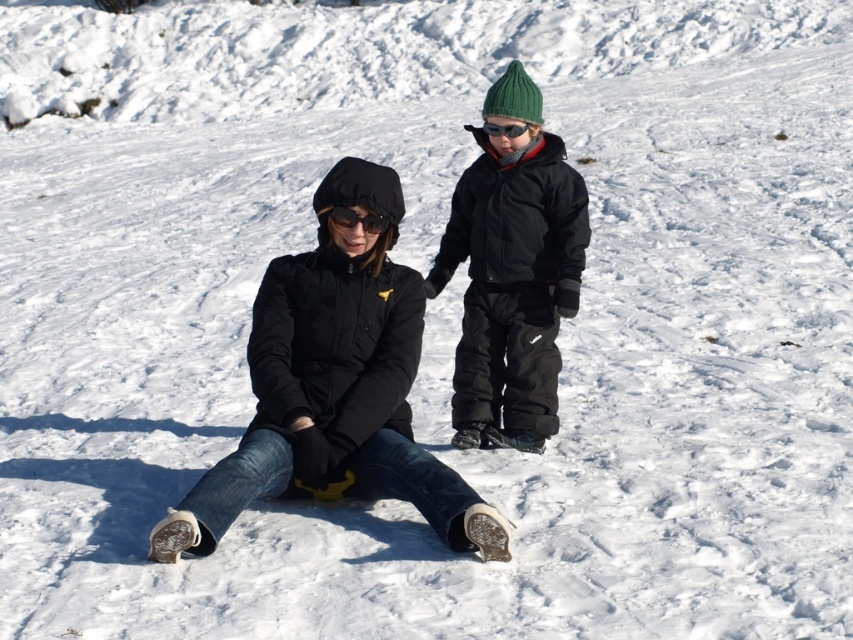
Who is more forward, (524, 372) or (367, 211)?

Point (367, 211) is more forward.

The height and width of the screenshot is (640, 853). Describe the element at coordinates (404, 340) in the screenshot. I see `black matte jacket at center` at that location.

Find the location of `black matte jacket at center`. black matte jacket at center is located at coordinates (404, 340).

Is point (349, 218) positioned after point (489, 125)?

No, (349, 218) is closer to viewer.

Consider the image. Is matte black goggles at center bigger than black matte goggles at upper center?

No.

The height and width of the screenshot is (640, 853). Identify the location of matte black goggles at center. (357, 220).

Identify the location of matte black goggles at center. (357, 220).

Does matte black snowsuit at right have a lesser width compared to black matte goggles at upper center?

Incorrect, matte black snowsuit at right's width is not less than black matte goggles at upper center's.

Can you confirm if matte black snowsuit at right is positioned to the left of black matte goggles at upper center?

Incorrect, matte black snowsuit at right is not on the left side of black matte goggles at upper center.

Does point (480, 300) come behind point (505, 132)?

That is True.

Locate an element on the screen. The image size is (853, 640). matte black snowsuit at right is located at coordinates (512, 272).